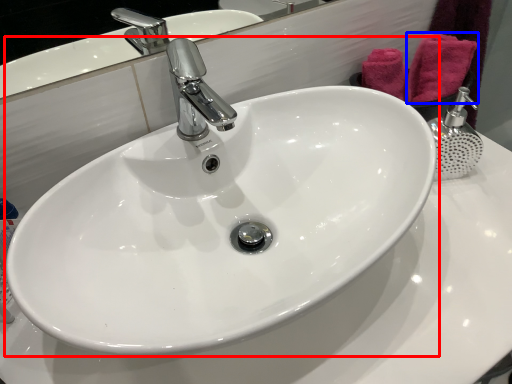
Question: Among these objects, which one is farthest to the camera, sink (highlighted by a red box) or bath towel (highlighted by a blue box)?

Choices:
 (A) sink
 (B) bath towel

Answer: (B)